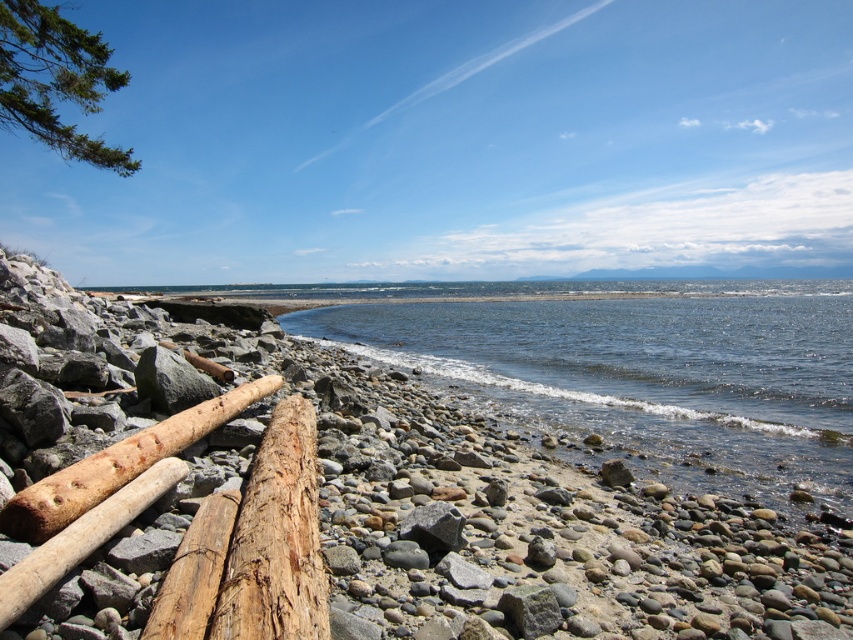
Question: Among these points, which one is nearest to the camera?

Choices:
 (A) (56, 516)
 (B) (428, 518)
 (C) (160, 458)

Answer: (A)

Question: Which object is positioned farthest from the brown rough wood at lower left?

Choices:
 (A) gray matte rock at center
 (B) clear water at center
 (C) gray rock at center

Answer: (B)

Question: Among these objects, which one is farthest from the camera?

Choices:
 (A) brown rough wood at lower left
 (B) gray rock at center
 (C) gray matte rock at center
 (D) weathered wood log at lower left

Answer: (C)

Question: Can you confirm if gray rock at center is positioned below gray matte rock at center?

Choices:
 (A) no
 (B) yes

Answer: (A)

Question: Can you confirm if gray rock at center is bigger than gray matte rock at center?

Choices:
 (A) no
 (B) yes

Answer: (B)

Question: From the image, what is the correct spatial relationship of clear water at center in relation to gray matte rock at center?

Choices:
 (A) below
 (B) above

Answer: (B)